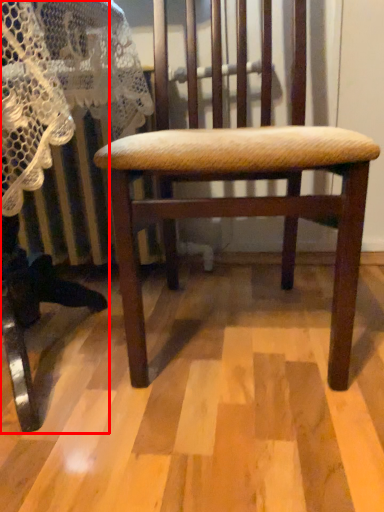
Question: From the image, what is the correct spatial relationship of rocking chair (annotated by the red box) in relation to chair?

Choices:
 (A) right
 (B) left

Answer: (B)